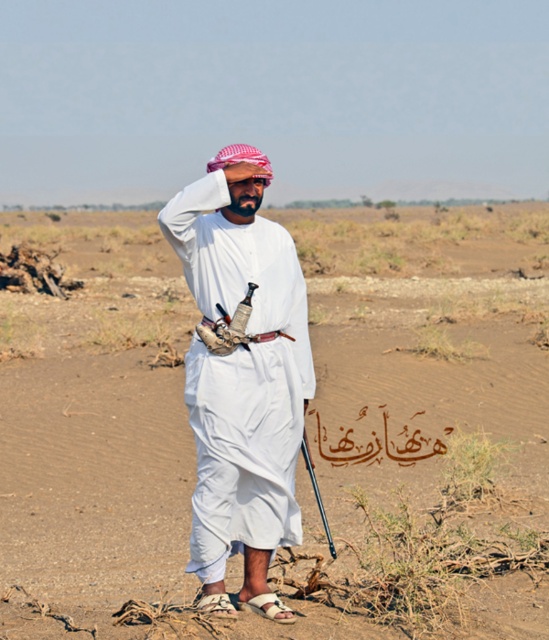
Question: Is brown sandy dirt field at center positioned behind white matte clothing at center?

Choices:
 (A) yes
 (B) no

Answer: (A)

Question: Is brown sandy dirt field at center to the left of white matte clothing at center from the viewer's perspective?

Choices:
 (A) no
 (B) yes

Answer: (B)

Question: Where is brown sandy dirt field at center located in relation to white matte clothing at center in the image?

Choices:
 (A) below
 (B) above

Answer: (B)

Question: Which point appears closest to the camera in this image?

Choices:
 (A) (182, 253)
 (B) (165, 333)

Answer: (A)

Question: Among these points, which one is nearest to the camera?

Choices:
 (A) (400, 605)
 (B) (284, 426)

Answer: (B)

Question: Which point is farther from the camera taking this photo?

Choices:
 (A) 211,531
 (B) 351,266

Answer: (B)